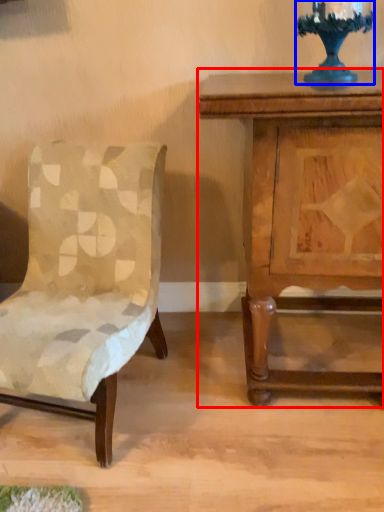
Question: Among these objects, which one is nearest to the camera, nightstand (highlighted by a red box) or candle holder (highlighted by a blue box)?

Choices:
 (A) nightstand
 (B) candle holder

Answer: (A)